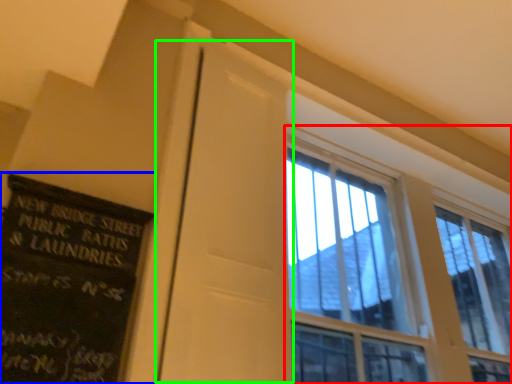
Question: Estimate the real-world distances between objects in this image. Which object is farther from window (highlighted by a red box), bulletin board (highlighted by a blue box) or screen door (highlighted by a green box)?

Choices:
 (A) bulletin board
 (B) screen door

Answer: (A)